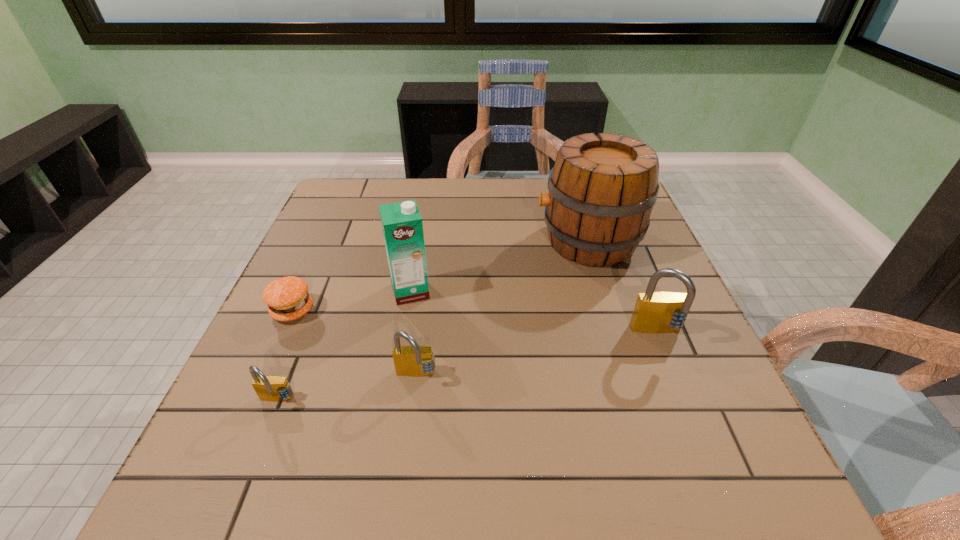
Where is `the nearest object`? The height and width of the screenshot is (540, 960). the nearest object is located at coordinates (268, 388).

This screenshot has width=960, height=540. I want to click on the leftmost padlock, so click(x=268, y=388).

Locate an element on the screen. This screenshot has height=540, width=960. the second padlock from left to right is located at coordinates (414, 361).

Identify the location of the second tallest padlock. The width and height of the screenshot is (960, 540). [414, 361].

Locate an element on the screen. This screenshot has width=960, height=540. the fourth shortest object is located at coordinates (655, 312).

The width and height of the screenshot is (960, 540). In order to click on the tallest padlock in this screenshot , I will do `click(655, 312)`.

Identify the location of the shortest object. (287, 298).

Where is `the farthest object`? The height and width of the screenshot is (540, 960). the farthest object is located at coordinates (602, 189).

Identify the location of carton. Image resolution: width=960 pixels, height=540 pixels. (402, 225).

Where is `free space located 0.050m on the side with the combination dials of the nearest object`? The width and height of the screenshot is (960, 540). free space located 0.050m on the side with the combination dials of the nearest object is located at coordinates (262, 437).